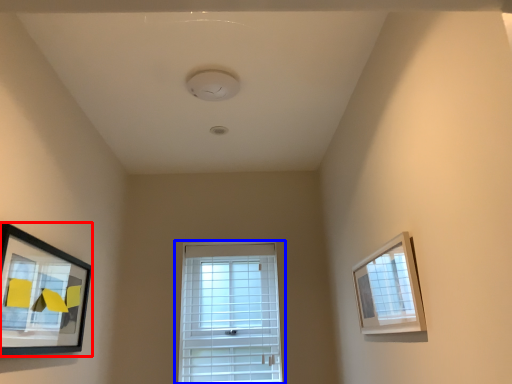
Question: Which of the following is the closest to the observer, picture frame (highlighted by a red box) or window (highlighted by a blue box)?

Choices:
 (A) picture frame
 (B) window

Answer: (A)